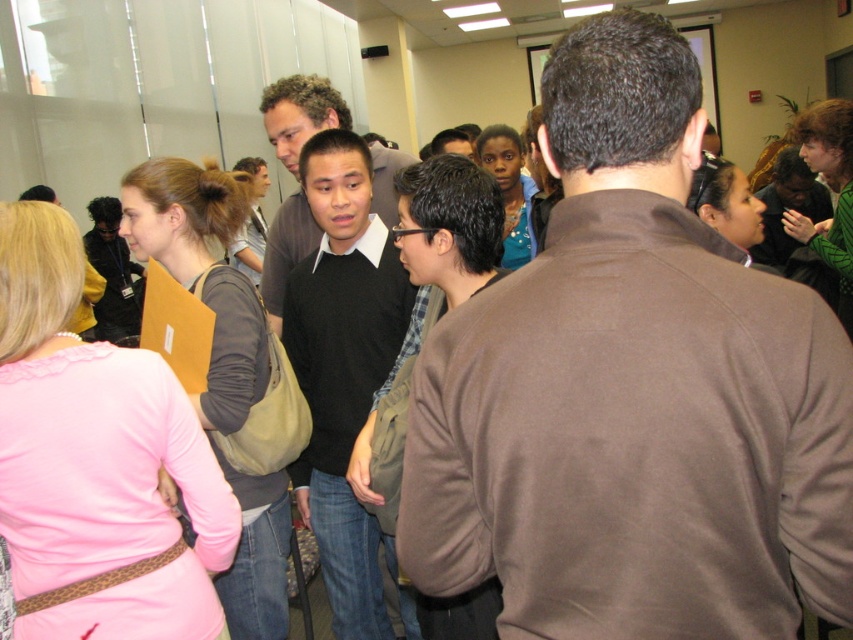
Is black sweater at center positioned behind matte beige folder at left?

Yes, it is.

Is black sweater at center bigger than matte beige folder at left?

Incorrect, black sweater at center is not larger than matte beige folder at left.

Where is `black sweater at center`? This screenshot has height=640, width=853. black sweater at center is located at coordinates (343, 364).

Does brown sweater at center appear under black matte sweater at center?

Yes, brown sweater at center is below black matte sweater at center.

Describe the element at coordinates (631, 394) in the screenshot. I see `brown sweater at center` at that location.

Where is `brown sweater at center`? The height and width of the screenshot is (640, 853). brown sweater at center is located at coordinates (631, 394).

Can you confirm if black sweater at center is positioned above black matte sweater at center?

Incorrect, black sweater at center is not positioned above black matte sweater at center.

Looking at this image, is black sweater at center thinner than black matte sweater at center?

Yes.

Describe the element at coordinates (343, 364) in the screenshot. I see `black sweater at center` at that location.

Locate an element on the screen. The height and width of the screenshot is (640, 853). black sweater at center is located at coordinates (343, 364).